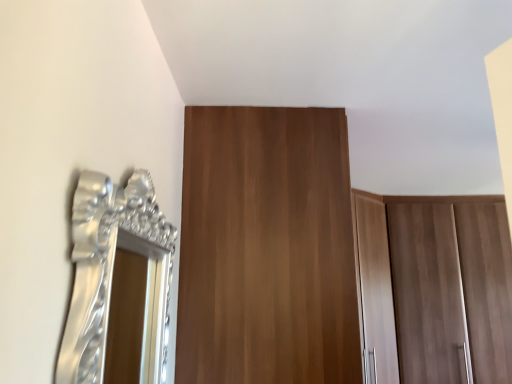
Describe the element at coordinates (267, 248) in the screenshot. The width and height of the screenshot is (512, 384). I see `brown wood door at upper center` at that location.

At what (x,y) coordinates should I click in order to perform the action: click on brown wood door at upper center. Please return your answer as a coordinate pair (x, y). The image size is (512, 384). Looking at the image, I should click on (267, 248).

Measure the distance between point (113, 231) and camera.

28.62 inches.

This screenshot has width=512, height=384. What do you see at coordinates (118, 284) in the screenshot?
I see `silver metallic mirror at left` at bounding box center [118, 284].

Where is `silver metallic mirror at left`? This screenshot has width=512, height=384. silver metallic mirror at left is located at coordinates (118, 284).

This screenshot has height=384, width=512. I want to click on brown wood door at upper center, so click(x=267, y=248).

Consider the image. Considering the positions of objects brown wood door at upper center and silver metallic mirror at left in the image provided, who is more to the left, brown wood door at upper center or silver metallic mirror at left?

silver metallic mirror at left is more to the left.

Between brown wood door at upper center and silver metallic mirror at left, which one is positioned in front?

silver metallic mirror at left.

Is point (215, 342) closer to viewer compared to point (156, 212)?

No.

From the image's perspective, does brown wood door at upper center appear lower than silver metallic mirror at left?

Yes, from the image's perspective, brown wood door at upper center is below silver metallic mirror at left.

From a real-world perspective, between brown wood door at upper center and silver metallic mirror at left, who is vertically lower?

In real-world perspective, brown wood door at upper center is lower.

Which object is thinner, brown wood door at upper center or silver metallic mirror at left?

With smaller width is silver metallic mirror at left.

Who is taller, brown wood door at upper center or silver metallic mirror at left?

brown wood door at upper center.

Considering the sizes of brown wood door at upper center and silver metallic mirror at left in the image, is brown wood door at upper center bigger or smaller than silver metallic mirror at left?

Clearly, brown wood door at upper center is larger in size than silver metallic mirror at left.

Could silver metallic mirror at left be considered to be inside brown wood door at upper center?

No, silver metallic mirror at left is not a part of brown wood door at upper center.

Looking at this image, are brown wood door at upper center and silver metallic mirror at left far apart?

No, brown wood door at upper center is not far away from silver metallic mirror at left.

Is brown wood door at upper center positioned with its back to silver metallic mirror at left?

No, brown wood door at upper center is not facing away from silver metallic mirror at left.

In the image, there is a silver metallic mirror at left. At what (x,y) coordinates should I click in order to perform the action: click on door below it (from the image's perspective). Please return your answer as a coordinate pair (x, y). The height and width of the screenshot is (384, 512). Looking at the image, I should click on (267, 248).

Does silver metallic mirror at left appear on the right side of brown wood door at upper center?

No.

Between silver metallic mirror at left and brown wood door at upper center, which one is positioned behind?

brown wood door at upper center.

Between point (113, 216) and point (211, 348), which one is positioned in front?

The point (113, 216) is closer.

From the image's perspective, between silver metallic mirror at left and brown wood door at upper center, who is located below?

brown wood door at upper center.

From a real-world perspective, is silver metallic mirror at left physically located above or below brown wood door at upper center?

silver metallic mirror at left is situated higher than brown wood door at upper center in the real world.

Considering the sizes of silver metallic mirror at left and brown wood door at upper center in the image, is silver metallic mirror at left wider or thinner than brown wood door at upper center?

Clearly, silver metallic mirror at left has less width compared to brown wood door at upper center.

Is silver metallic mirror at left taller than brown wood door at upper center?

Incorrect, the height of silver metallic mirror at left is not larger of that of brown wood door at upper center.

Considering the relative sizes of silver metallic mirror at left and brown wood door at upper center in the image provided, is silver metallic mirror at left smaller than brown wood door at upper center?

Indeed, silver metallic mirror at left has a smaller size compared to brown wood door at upper center.

Is brown wood door at upper center a part of silver metallic mirror at left?

Actually, brown wood door at upper center is outside silver metallic mirror at left.

Is silver metallic mirror at left positioned far away from brown wood door at upper center?

They are positioned close to each other.

Consider the image. Could you tell me if silver metallic mirror at left is turned towards brown wood door at upper center?

No, silver metallic mirror at left is not turned towards brown wood door at upper center.

Where is `door on the right side of silver metallic mirror at left`? The width and height of the screenshot is (512, 384). door on the right side of silver metallic mirror at left is located at coordinates (267, 248).

This screenshot has width=512, height=384. Find the location of `mirror on the left of brown wood door at upper center`. mirror on the left of brown wood door at upper center is located at coordinates (118, 284).

The height and width of the screenshot is (384, 512). What are the coordinates of `door that is under the silver metallic mirror at left (from a real-world perspective)` in the screenshot? It's located at (267, 248).